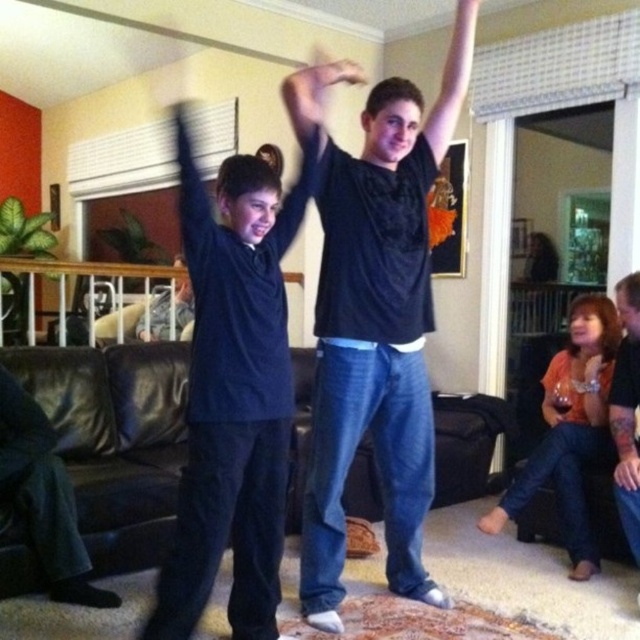
Question: Does black matte t-shirt at center appear on the right side of dark blue sweater at center?

Choices:
 (A) no
 (B) yes

Answer: (B)

Question: Does orange fabric shirt at lower right appear under dark blue jeans at lower right?

Choices:
 (A) yes
 (B) no

Answer: (B)

Question: Among these objects, which one is nearest to the camera?

Choices:
 (A) tattooed skin at upper right
 (B) orange fabric shirt at lower right

Answer: (A)

Question: Which point appears farthest from the camera in this image?

Choices:
 (A) (620, 422)
 (B) (320, 90)

Answer: (A)

Question: Estimate the real-world distances between objects in this image. Which object is closer to the dark blue jeans at lower right?

Choices:
 (A) tattooed skin at upper right
 (B) matte black shirt at upper center
 (C) matte black hand at center
 (D) dark blue sweater at center

Answer: (A)

Question: Can you confirm if dark blue jeans at lower right is bigger than matte black shirt at upper center?

Choices:
 (A) yes
 (B) no

Answer: (A)